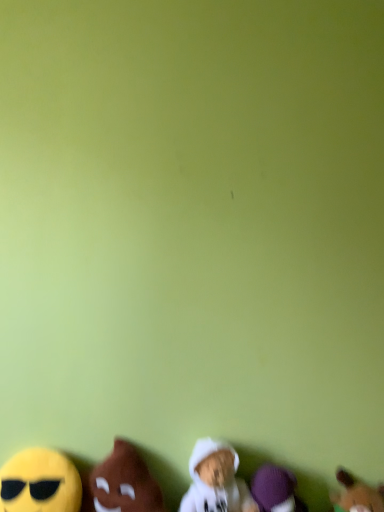
Image resolution: width=384 pixels, height=512 pixels. Identify the location of yellow plush toy at lower left, positioned as the 1th toy in left-to-right order. (40, 482).

The width and height of the screenshot is (384, 512). What do you see at coordinates (275, 490) in the screenshot?
I see `purple plush toy at lower right, which ranks as the second toy in right-to-left order` at bounding box center [275, 490].

In order to click on white plush toy at lower center, which is the third toy from right to left in this screenshot , I will do `click(216, 480)`.

Where is `yellow plush toy at lower left, positioned as the 1th toy in left-to-right order`? This screenshot has width=384, height=512. yellow plush toy at lower left, positioned as the 1th toy in left-to-right order is located at coordinates (40, 482).

Is yellow plush toy at lower left, positioned as the 1th toy in left-to-right order, in front of or behind purple plush toy at lower right, which is counted as the 4th toy, starting from the left, in the image?

Clearly, yellow plush toy at lower left, positioned as the 1th toy in left-to-right order, is in front of purple plush toy at lower right, which is counted as the 4th toy, starting from the left.

Consider the image. From the image's perspective, relative to purple plush toy at lower right, which ranks as the second toy in right-to-left order, is yellow plush toy at lower left, the 5th toy when ordered from right to left, above or below?

Based on their image positions, yellow plush toy at lower left, the 5th toy when ordered from right to left, is located above purple plush toy at lower right, which ranks as the second toy in right-to-left order.

In terms of height, does yellow plush toy at lower left, the 5th toy when ordered from right to left, look taller or shorter compared to purple plush toy at lower right, which ranks as the second toy in right-to-left order?

In the image, yellow plush toy at lower left, the 5th toy when ordered from right to left, appears to be taller than purple plush toy at lower right, which ranks as the second toy in right-to-left order.

Is yellow plush toy at lower left, the 5th toy when ordered from right to left, oriented away from purple plush toy at lower right, which is counted as the 4th toy, starting from the left?

yellow plush toy at lower left, the 5th toy when ordered from right to left, does not have its back to purple plush toy at lower right, which is counted as the 4th toy, starting from the left.

Is brown plush toy at lower right, positioned as the 1th toy in right-to-left order, wider than white plush toy at lower center, which is the third toy from right to left?

In fact, brown plush toy at lower right, positioned as the 1th toy in right-to-left order, might be narrower than white plush toy at lower center, which is the third toy from right to left.

Are brown plush toy at lower right, the fifth toy in the left-to-right sequence, and white plush toy at lower center, which is the third toy from right to left, far apart?

No.

Which object is further away from the camera, brown plush toy at lower right, positioned as the 1th toy in right-to-left order, or white plush toy at lower center, positioned as the 3th toy in left-to-right order?

brown plush toy at lower right, positioned as the 1th toy in right-to-left order, is behind.

From the image's perspective, is purple plush toy at lower right, which ranks as the second toy in right-to-left order, above white plush toy at lower center, which is the third toy from right to left?

No, from the image's perspective, purple plush toy at lower right, which ranks as the second toy in right-to-left order, is not above white plush toy at lower center, which is the third toy from right to left.

This screenshot has width=384, height=512. I want to click on toy that is the 1st object to the right of the white plush toy at lower center, positioned as the 3th toy in left-to-right order, starting at the anchor, so click(275, 490).

Considering the sizes of purple plush toy at lower right, which ranks as the second toy in right-to-left order, and white plush toy at lower center, positioned as the 3th toy in left-to-right order, in the image, is purple plush toy at lower right, which ranks as the second toy in right-to-left order, wider or thinner than white plush toy at lower center, positioned as the 3th toy in left-to-right order,?

Considering their sizes, purple plush toy at lower right, which ranks as the second toy in right-to-left order, looks slimmer than white plush toy at lower center, positioned as the 3th toy in left-to-right order.

Can you tell me how much purple plush toy at lower right, which ranks as the second toy in right-to-left order, and white plush toy at lower center, which is the third toy from right to left, differ in facing direction?

They differ by 0.000395 degrees in their facing directions.

From the image's perspective, which is below, purple plush toy at lower right, which ranks as the second toy in right-to-left order, or brown plush toy at lower right, the fifth toy in the left-to-right sequence?

From the image's view, brown plush toy at lower right, the fifth toy in the left-to-right sequence, is below.

From a real-world perspective, is purple plush toy at lower right, which ranks as the second toy in right-to-left order, located beneath brown plush toy at lower right, the fifth toy in the left-to-right sequence?

Indeed, from a real-world perspective, purple plush toy at lower right, which ranks as the second toy in right-to-left order, is positioned beneath brown plush toy at lower right, the fifth toy in the left-to-right sequence.

Is there a large distance between purple plush toy at lower right, which is counted as the 4th toy, starting from the left, and brown plush toy at lower right, positioned as the 1th toy in right-to-left order?

No, purple plush toy at lower right, which is counted as the 4th toy, starting from the left, is not far from brown plush toy at lower right, positioned as the 1th toy in right-to-left order.

From a real-world perspective, relative to brown plush toy at lower left, acting as the 4th toy starting from the right, is yellow plush toy at lower left, the 5th toy when ordered from right to left, vertically above or below?

From a real-world perspective, yellow plush toy at lower left, the 5th toy when ordered from right to left, is physically below brown plush toy at lower left, acting as the 4th toy starting from the right.

Considering the relative sizes of yellow plush toy at lower left, positioned as the 1th toy in left-to-right order, and brown plush toy at lower left, acting as the 4th toy starting from the right, in the image provided, is yellow plush toy at lower left, positioned as the 1th toy in left-to-right order, shorter than brown plush toy at lower left, acting as the 4th toy starting from the right,?

Indeed, yellow plush toy at lower left, positioned as the 1th toy in left-to-right order, has a lesser height compared to brown plush toy at lower left, acting as the 4th toy starting from the right.

Considering the points (4, 465) and (146, 503), which point is in front, point (4, 465) or point (146, 503)?

The point (146, 503) is closer.

Can you tell me how much brown plush toy at lower right, the fifth toy in the left-to-right sequence, and purple plush toy at lower right, which is counted as the 4th toy, starting from the left, differ in facing direction?

They differ by 4.95 degrees in their facing directions.

Would you consider brown plush toy at lower right, positioned as the 1th toy in right-to-left order, to be distant from purple plush toy at lower right, which is counted as the 4th toy, starting from the left?

No.

Considering their positions, is brown plush toy at lower right, positioned as the 1th toy in right-to-left order, located in front of or behind purple plush toy at lower right, which is counted as the 4th toy, starting from the left?

Visually, brown plush toy at lower right, positioned as the 1th toy in right-to-left order, is located in front of purple plush toy at lower right, which is counted as the 4th toy, starting from the left.

Is white plush toy at lower center, positioned as the 3th toy in left-to-right order, aimed at brown plush toy at lower left, acting as the 4th toy starting from the right?

No.

Does white plush toy at lower center, positioned as the 3th toy in left-to-right order, have a greater width compared to brown plush toy at lower left, the second toy viewed from the left?

Incorrect, the width of white plush toy at lower center, positioned as the 3th toy in left-to-right order, does not surpass that of brown plush toy at lower left, the second toy viewed from the left.

Between white plush toy at lower center, positioned as the 3th toy in left-to-right order, and brown plush toy at lower left, the second toy viewed from the left, which one has more height?

white plush toy at lower center, positioned as the 3th toy in left-to-right order, is taller.

Locate an element on the screen. Image resolution: width=384 pixels, height=512 pixels. the 4th toy behind the yellow plush toy at lower left, the 5th toy when ordered from right to left, counting from the anchor's position is located at coordinates (275, 490).

Find the location of `the 2nd toy to the right of the white plush toy at lower center, positioned as the 3th toy in left-to-right order, starting your count from the anchor`. the 2nd toy to the right of the white plush toy at lower center, positioned as the 3th toy in left-to-right order, starting your count from the anchor is located at coordinates 357,494.

From the image, which object appears to be farther from white plush toy at lower center, positioned as the 3th toy in left-to-right order, purple plush toy at lower right, which is counted as the 4th toy, starting from the left, or brown plush toy at lower right, the fifth toy in the left-to-right sequence?

Based on the image, brown plush toy at lower right, the fifth toy in the left-to-right sequence, appears to be further to white plush toy at lower center, positioned as the 3th toy in left-to-right order.

Looking at the image, which one is located further to brown plush toy at lower right, the fifth toy in the left-to-right sequence, white plush toy at lower center, which is the third toy from right to left, or purple plush toy at lower right, which ranks as the second toy in right-to-left order?

white plush toy at lower center, which is the third toy from right to left.

Considering their positions, is yellow plush toy at lower left, the 5th toy when ordered from right to left, positioned closer to brown plush toy at lower right, positioned as the 1th toy in right-to-left order, than white plush toy at lower center, which is the third toy from right to left?

Among the two, white plush toy at lower center, which is the third toy from right to left, is located nearer to brown plush toy at lower right, positioned as the 1th toy in right-to-left order.

Considering their positions, is brown plush toy at lower right, positioned as the 1th toy in right-to-left order, positioned further to brown plush toy at lower left, acting as the 4th toy starting from the right, than purple plush toy at lower right, which ranks as the second toy in right-to-left order?

brown plush toy at lower right, positioned as the 1th toy in right-to-left order.

Estimate the real-world distances between objects in this image. Which object is closer to brown plush toy at lower right, the fifth toy in the left-to-right sequence, purple plush toy at lower right, which ranks as the second toy in right-to-left order, or yellow plush toy at lower left, the 5th toy when ordered from right to left?

Based on the image, purple plush toy at lower right, which ranks as the second toy in right-to-left order, appears to be nearer to brown plush toy at lower right, the fifth toy in the left-to-right sequence.

From the image, which object appears to be farther from purple plush toy at lower right, which is counted as the 4th toy, starting from the left, white plush toy at lower center, positioned as the 3th toy in left-to-right order, or brown plush toy at lower left, the second toy viewed from the left?

brown plush toy at lower left, the second toy viewed from the left, is positioned further to the anchor purple plush toy at lower right, which is counted as the 4th toy, starting from the left.

From the image, which object appears to be farther from white plush toy at lower center, positioned as the 3th toy in left-to-right order, brown plush toy at lower left, acting as the 4th toy starting from the right, or yellow plush toy at lower left, positioned as the 1th toy in left-to-right order?

Based on the image, yellow plush toy at lower left, positioned as the 1th toy in left-to-right order, appears to be further to white plush toy at lower center, positioned as the 3th toy in left-to-right order.

Which object lies further to the anchor point brown plush toy at lower left, the second toy viewed from the left, white plush toy at lower center, which is the third toy from right to left, or purple plush toy at lower right, which is counted as the 4th toy, starting from the left?

purple plush toy at lower right, which is counted as the 4th toy, starting from the left, lies further to brown plush toy at lower left, the second toy viewed from the left, than the other object.

Identify the location of toy located between brown plush toy at lower left, acting as the 4th toy starting from the right, and purple plush toy at lower right, which ranks as the second toy in right-to-left order, in the left-right direction. The image size is (384, 512). (216, 480).

You are a GUI agent. You are given a task and a screenshot of the screen. Output one action in this format:
    pyautogui.click(x=<x>, y=<y>)
    Task: Click on the toy between yellow plush toy at lower left, positioned as the 1th toy in left-to-right order, and white plush toy at lower center, positioned as the 3th toy in left-to-right order, from left to right
    The width and height of the screenshot is (384, 512).
    Given the screenshot: What is the action you would take?
    pyautogui.click(x=124, y=483)

I want to click on toy located between white plush toy at lower center, which is the third toy from right to left, and brown plush toy at lower right, positioned as the 1th toy in right-to-left order, in the left-right direction, so click(275, 490).